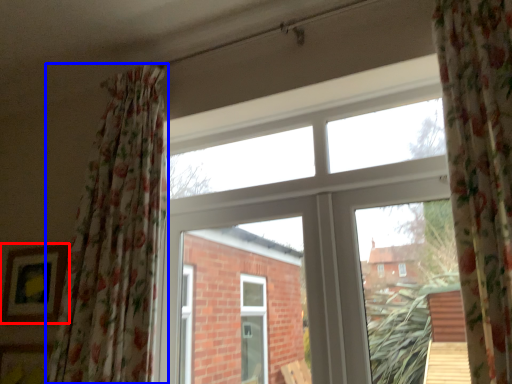
Question: Which object appears farthest to the camera in this image, picture frame (highlighted by a red box) or curtain (highlighted by a blue box)?

Choices:
 (A) picture frame
 (B) curtain

Answer: (A)